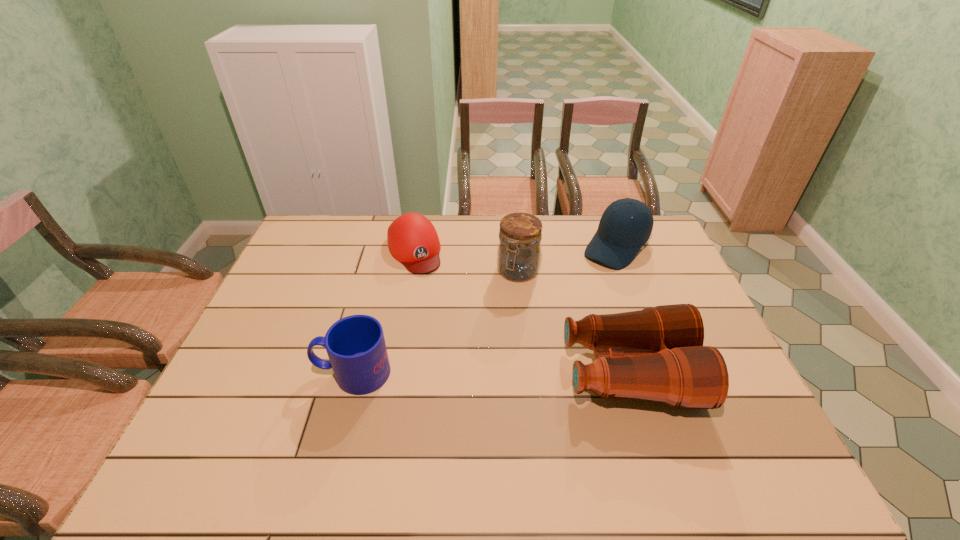
The width and height of the screenshot is (960, 540). I want to click on vacant space on the desktop that is between the mug and the binoculars and is positioned on the front-facing side of the shortest object, so click(474, 373).

The height and width of the screenshot is (540, 960). I want to click on free space on the desktop that is between the mug and the binoculars and is positioned on the front-facing side of the taller baseball cap, so click(x=502, y=373).

Where is `vacant space on the desktop that is between the mug and the binoculars and is positioned on the lid of the jar`? Image resolution: width=960 pixels, height=540 pixels. vacant space on the desktop that is between the mug and the binoculars and is positioned on the lid of the jar is located at coordinates (459, 373).